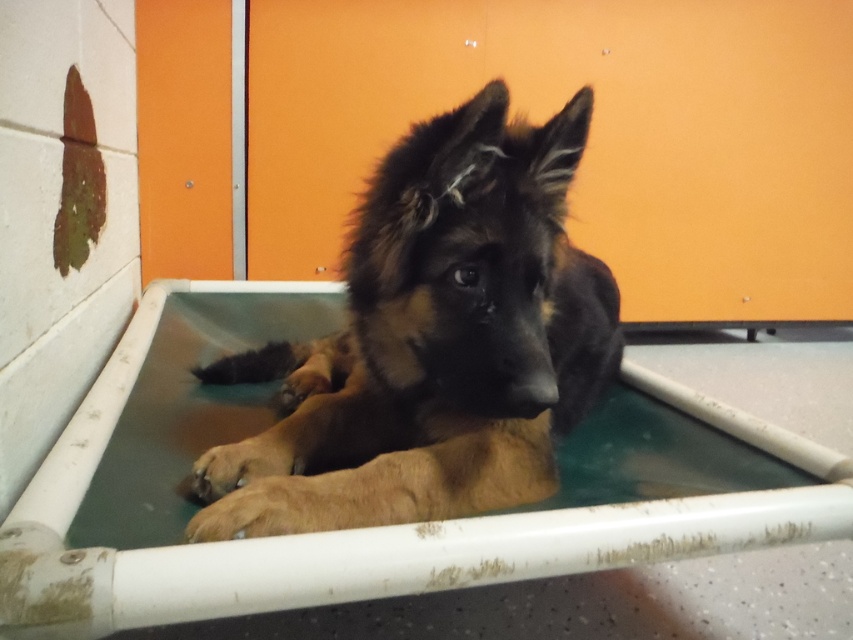
Who is taller, brown fur dog at center or green plastic bath at center?

brown fur dog at center

Who is higher up, brown fur dog at center or green plastic bath at center?

brown fur dog at center

The height and width of the screenshot is (640, 853). What are the coordinates of `brown fur dog at center` in the screenshot? It's located at (432, 342).

Where is `brown fur dog at center`? brown fur dog at center is located at coordinates (432, 342).